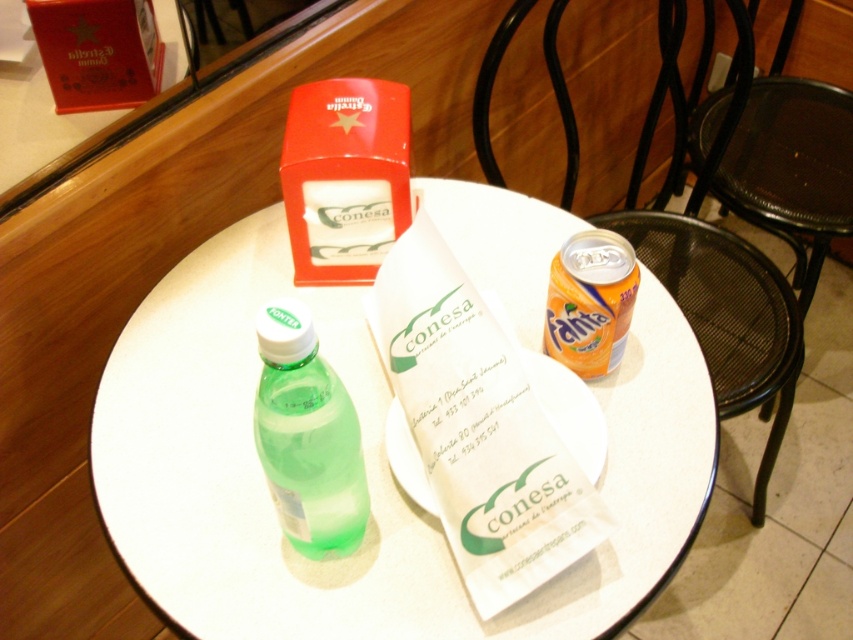
Who is higher up, white paper menu at center or orange matte can at upper right?

orange matte can at upper right is higher up.

What do you see at coordinates (483, 426) in the screenshot?
I see `white paper menu at center` at bounding box center [483, 426].

Who is more forward, (554, 524) or (596, 360)?

Point (554, 524) is in front.

Image resolution: width=853 pixels, height=640 pixels. In order to click on white paper menu at center in this screenshot , I will do `click(483, 426)`.

Between green translucent bottle at center and orange matte can at upper right, which one is positioned higher?

orange matte can at upper right

Can you confirm if green translucent bottle at center is wider than orange matte can at upper right?

Incorrect, green translucent bottle at center's width does not surpass orange matte can at upper right's.

Is point (273, 419) positioned in front of point (566, 280)?

Yes, point (273, 419) is closer to viewer.

I want to click on green translucent bottle at center, so click(x=306, y=436).

Is red plastic napkin dispenser at upper center above green translucent bottle at center?

Correct, red plastic napkin dispenser at upper center is located above green translucent bottle at center.

Can you confirm if red plastic napkin dispenser at upper center is smaller than green translucent bottle at center?

No, red plastic napkin dispenser at upper center is not smaller than green translucent bottle at center.

What do you see at coordinates (345, 177) in the screenshot? I see `red plastic napkin dispenser at upper center` at bounding box center [345, 177].

Where is `red plastic napkin dispenser at upper center`? The width and height of the screenshot is (853, 640). red plastic napkin dispenser at upper center is located at coordinates (345, 177).